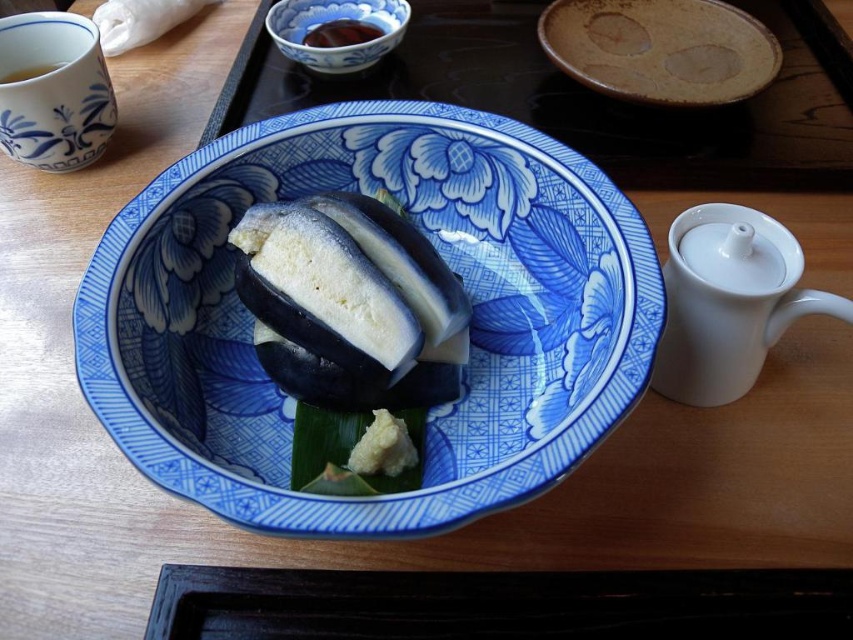
Consider the image. You are sitting at the table and want to pour tea from the white glossy teapot at right into a cup located near the brown glossy sauce at upper center. Can you do this without moving the sauce?

The white glossy teapot at right is closer to the viewer than the brown glossy sauce at upper center, so you can pour the tea from the white glossy teapot at right into the cup near the brown glossy sauce at upper center without moving the sauce because the teapot is within reach.

Looking at this image, you are a guest at a Japanese meal and need to place your chopsticks on the table. The host has placed a brown matte platter at upper center and a blue porcelain bowl at upper center. Which object should you choose to place your chopsticks on, considering their size?

The brown matte platter at upper center is larger in size than the blue porcelain bowl at upper center, so you should place your chopsticks on the brown matte platter at upper center because it provides a more stable and spacious surface.

You are a chef arranging dishes on a table. You have a brown matte platter at upper center. Where exactly should you place it to match the image?

The brown matte platter at upper center should be placed at point (660, 49) to match the image.